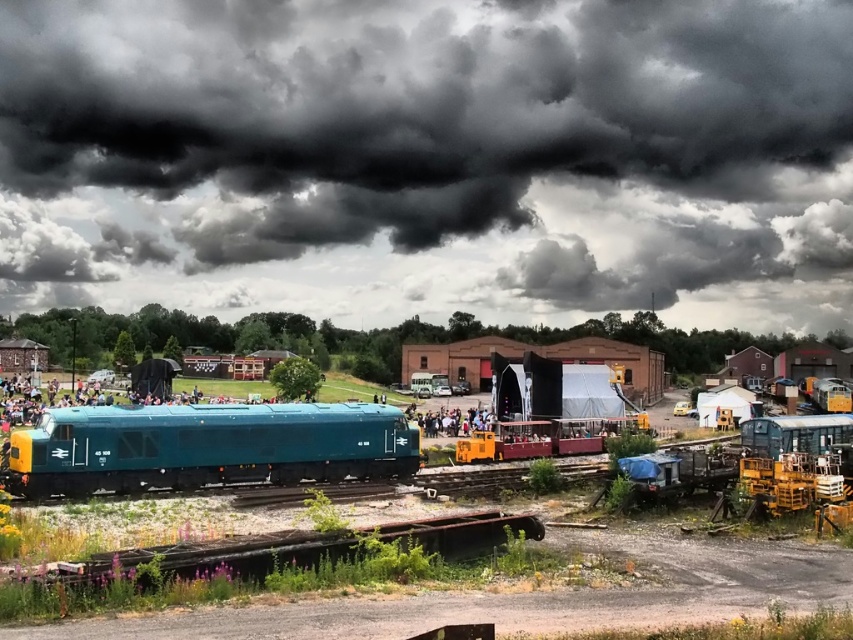
You are a photographer standing at the back of the teal glossy locomotive at center and want to take a clear photo of the light brown wooden bench at center. Is the bench visible in the photo?

The teal glossy locomotive at center is positioned over light brown wooden bench at center, so the bench is blocked by the locomotive and not visible in the photo.

You are standing at the point marked as point (428, 156) in the image. Looking around, what object is directly above you?

The dark gray cloud at upper center is directly above point (428, 156).